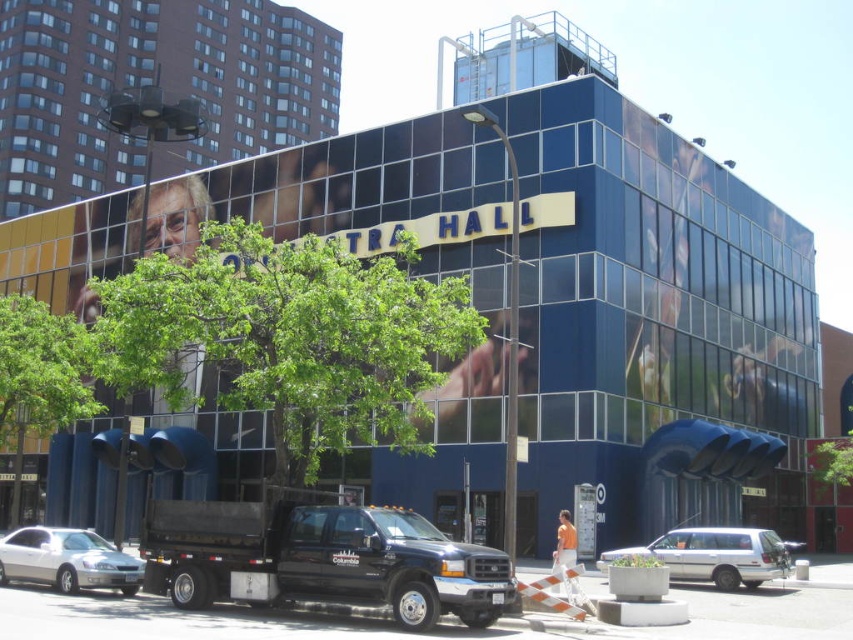
Consider the image. You are standing on the sidewalk next to the small concrete planter with greenery. You want to walk to the TRAX HALL building. Which tree should you walk towards to get closer to the building first, the green leafy tree at center or the green leafy tree at lower left?

You should walk towards the green leafy tree at center because it is closer to the viewer, meaning it is nearer to your current position on the sidewalk. This would place you closer to the TRAX HALL building before reaching the green leafy tree at lower left, which is farther away.

You are standing on the sidewalk next to the small concrete planter with greenery and need to walk to the TRAX HALL building entrance. Which direction should you head relative to the green leafy tree at center?

The green leafy tree at center is located at point (289, 337), so you should head towards the building entrance, which is likely in the direction opposite to the tree since the tree is centrally positioned in the scene.

You are a delivery driver who needs to park a truck that is 2 meters wide. There is a space between the green leafy tree at center and the silver metallic sedan at lower left. Can your truck fit in that space?

The green leafy tree at center is wider than the silver metallic sedan at lower left. However, the width of the space between them isn